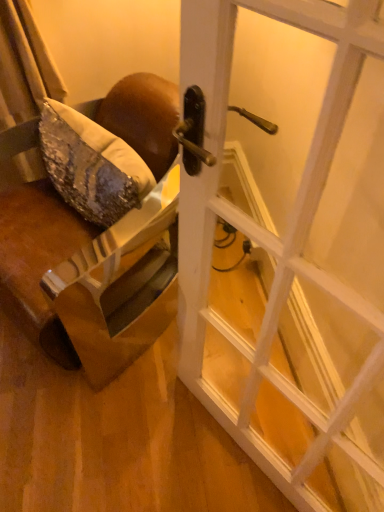
What do you see at coordinates (271, 232) in the screenshot?
I see `white glossy door at center` at bounding box center [271, 232].

You are a GUI agent. You are given a task and a screenshot of the screen. Output one action in this format:
    pyautogui.click(x=<x>, y=<y>)
    Task: Click on the white glossy door at center
    This screenshot has height=512, width=384.
    Given the screenshot: What is the action you would take?
    pyautogui.click(x=271, y=232)

What do you see at coordinates (38, 260) in the screenshot?
I see `brown leather chair at left` at bounding box center [38, 260].

The width and height of the screenshot is (384, 512). Identify the location of brown leather chair at left. 38,260.

Measure the distance between brown leather chair at left and camera.

A distance of 1.15 meters exists between brown leather chair at left and camera.

What is the approximate height of brown leather chair at left?

brown leather chair at left is 28.32 inches tall.

Find the location of a particular element. The width and height of the screenshot is (384, 512). white glossy door at center is located at coordinates (271, 232).

Considering the relative positions of white glossy door at center and brown leather chair at left in the image provided, is white glossy door at center to the left of brown leather chair at left from the viewer's perspective?

In fact, white glossy door at center is to the right of brown leather chair at left.

Between white glossy door at center and brown leather chair at left, which one is positioned in front?

Positioned in front is white glossy door at center.

Which point is more forward, (272, 324) or (123, 103)?

The point (272, 324) is closer.

From the image's perspective, which is below, white glossy door at center or brown leather chair at left?

white glossy door at center, from the image's perspective.

From a real-world perspective, between white glossy door at center and brown leather chair at left, who is vertically higher?

white glossy door at center is physically above.

Which object is wider, white glossy door at center or brown leather chair at left?

With larger width is brown leather chair at left.

Is white glossy door at center taller or shorter than brown leather chair at left?

white glossy door at center is taller than brown leather chair at left.

Looking at the image, does white glossy door at center seem bigger or smaller compared to brown leather chair at left?

In the image, white glossy door at center appears to be smaller than brown leather chair at left.

Is brown leather chair at left a part of white glossy door at center?

That's incorrect, brown leather chair at left is not inside white glossy door at center.

Are white glossy door at center and brown leather chair at left beside each other?

There is a gap between white glossy door at center and brown leather chair at left.

Is white glossy door at center oriented away from brown leather chair at left?

white glossy door at center does not have its back to brown leather chair at left.

Locate an element on the screen. The height and width of the screenshot is (512, 384). chair to the left of white glossy door at center is located at coordinates (38, 260).

Is brown leather chair at left to the left or to the right of white glossy door at center in the image?

From the image, it's evident that brown leather chair at left is to the left of white glossy door at center.

Which object is further away from the camera, brown leather chair at left or white glossy door at center?

brown leather chair at left.

Considering the positions of points (6, 226) and (213, 188), is point (6, 226) farther from camera compared to point (213, 188)?

Yes.

From the picture: From the image's perspective, is brown leather chair at left below white glossy door at center?

Actually, brown leather chair at left appears above white glossy door at center in the image.

From a real-world perspective, relative to white glossy door at center, is brown leather chair at left vertically above or below?

In terms of real-world spatial position, brown leather chair at left is below white glossy door at center.

Looking at their sizes, would you say brown leather chair at left is wider or thinner than white glossy door at center?

Clearly, brown leather chair at left has more width compared to white glossy door at center.

Considering the relative sizes of brown leather chair at left and white glossy door at center in the image provided, is brown leather chair at left shorter than white glossy door at center?

Indeed, brown leather chair at left has a lesser height compared to white glossy door at center.

Considering the relative sizes of brown leather chair at left and white glossy door at center in the image provided, is brown leather chair at left bigger than white glossy door at center?

Yes, brown leather chair at left is bigger than white glossy door at center.

Is white glossy door at center surrounded by brown leather chair at left?

No.

Would you say brown leather chair at left is a long distance from white glossy door at center?

No, brown leather chair at left is not far away from white glossy door at center.

Is brown leather chair at left aimed at white glossy door at center?

No.

Can you tell me how much brown leather chair at left and white glossy door at center differ in facing direction?

The facing directions of brown leather chair at left and white glossy door at center are 4.82 degrees apart.

In order to click on door in front of the brown leather chair at left in this screenshot , I will do `click(271, 232)`.

You are a GUI agent. You are given a task and a screenshot of the screen. Output one action in this format:
    pyautogui.click(x=<x>, y=<y>)
    Task: Click on the door lying on the right of brown leather chair at left
    The image size is (384, 512).
    Given the screenshot: What is the action you would take?
    pyautogui.click(x=271, y=232)

Locate an element on the screen. The image size is (384, 512). chair that is behind the white glossy door at center is located at coordinates (38, 260).